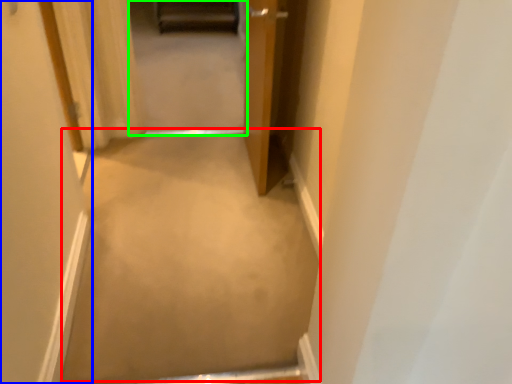
Question: Based on their relative distances, which object is nearer to plain (highlighted by a red box)? Choose from door (highlighted by a blue box) and passage (highlighted by a green box).

Choices:
 (A) door
 (B) passage

Answer: (A)